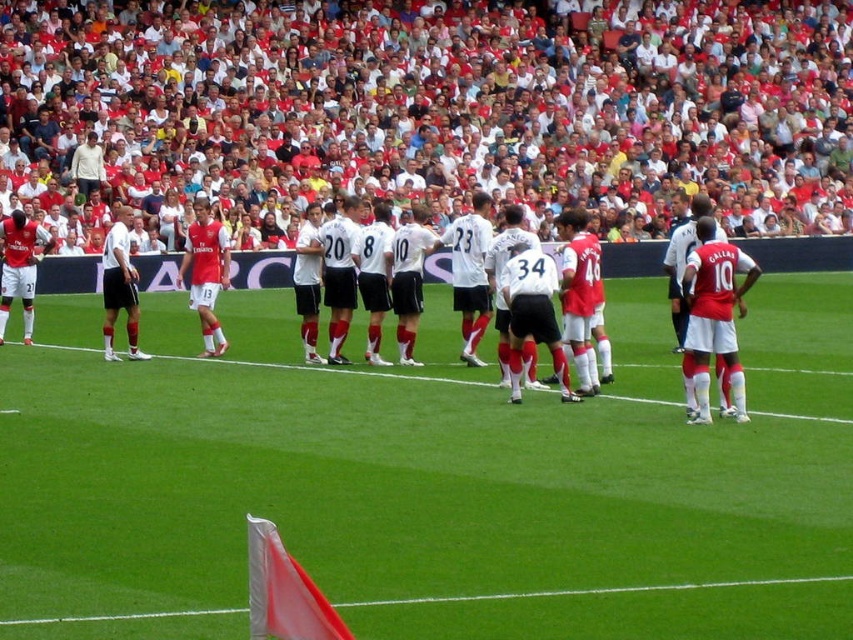
Between matte red jersey at center and white matte jersey at center, which one appears on the left side from the viewer's perspective?

Positioned to the left is white matte jersey at center.

Where is `matte red jersey at center`? matte red jersey at center is located at coordinates (206, 273).

Where is `matte red jersey at center`? This screenshot has height=640, width=853. matte red jersey at center is located at coordinates (206, 273).

Between green grass field at center and red fabric corner at lower center, which one is positioned lower?

red fabric corner at lower center

Which is in front, point (289, 346) or point (224, 614)?

Positioned in front is point (224, 614).

Between point (838, 376) and point (509, 595), which one is positioned behind?

Point (838, 376)

Find the location of a particular element. The width and height of the screenshot is (853, 640). green grass field at center is located at coordinates (428, 483).

Is red fabric corner at lower center below matte red jersey at center?

Yes.

Which is more to the left, red fabric corner at lower center or matte red jersey at center?

Positioned to the left is matte red jersey at center.

Who is more forward, (236, 612) or (213, 320)?

Positioned in front is point (236, 612).

The width and height of the screenshot is (853, 640). Identify the location of red fabric corner at lower center. (593, 592).